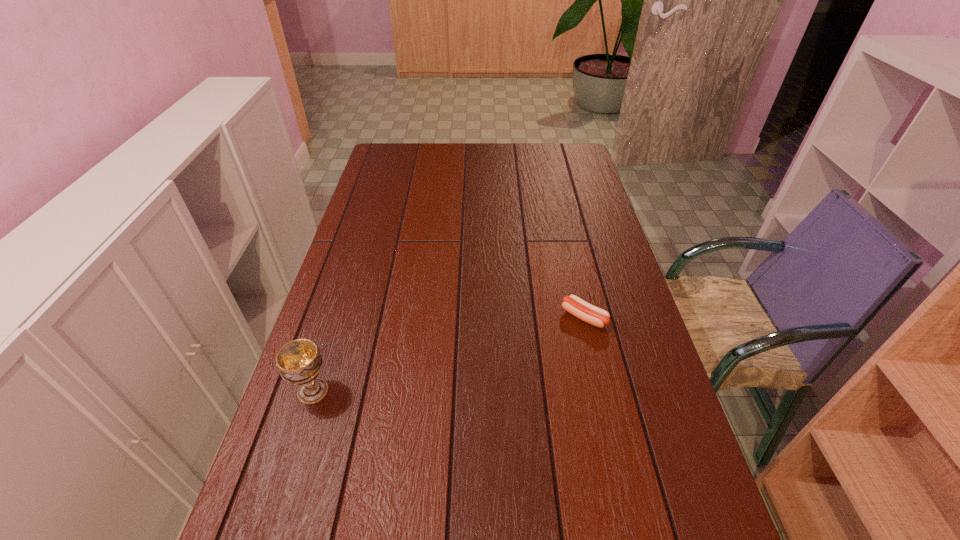
You are a GUI agent. You are given a task and a screenshot of the screen. Output one action in this format:
    pyautogui.click(x=<x>, y=<y>)
    Task: Click on the vacant space at the right edge of the desktop
    Image resolution: width=960 pixels, height=540 pixels.
    Given the screenshot: What is the action you would take?
    pyautogui.click(x=706, y=520)

Where is `vacant space at the far left corner of the desktop`? vacant space at the far left corner of the desktop is located at coordinates (405, 157).

You are a GUI agent. You are given a task and a screenshot of the screen. Output one action in this format:
    pyautogui.click(x=<x>, y=<y>)
    Task: Click on the free location that satisfies the following two spatial constraints: 1. on the back side of the farther object; 2. on the right side of the left object
    This screenshot has width=960, height=540.
    Given the screenshot: What is the action you would take?
    tap(337, 317)

Where is `blank area in the image that satisfies the following two spatial constraints: 1. on the back side of the nearer object; 2. on the left side of the farther object`? The height and width of the screenshot is (540, 960). blank area in the image that satisfies the following two spatial constraints: 1. on the back side of the nearer object; 2. on the left side of the farther object is located at coordinates (337, 317).

You are a GUI agent. You are given a task and a screenshot of the screen. Output one action in this format:
    pyautogui.click(x=<x>, y=<y>)
    Task: Click on the vacant space that satisfies the following two spatial constraints: 1. on the back side of the sausage; 2. on the right side of the chalice
    The height and width of the screenshot is (540, 960).
    Given the screenshot: What is the action you would take?
    pyautogui.click(x=337, y=317)